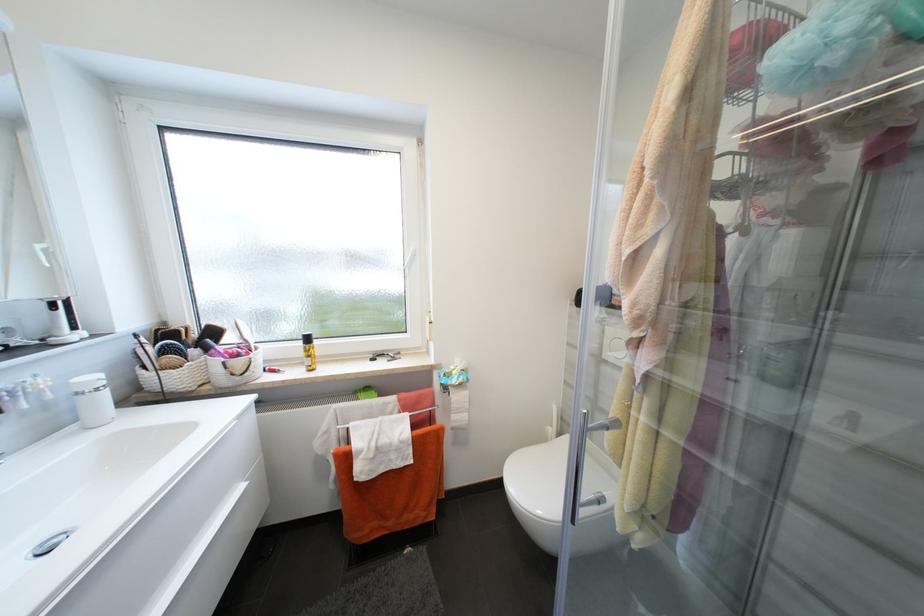
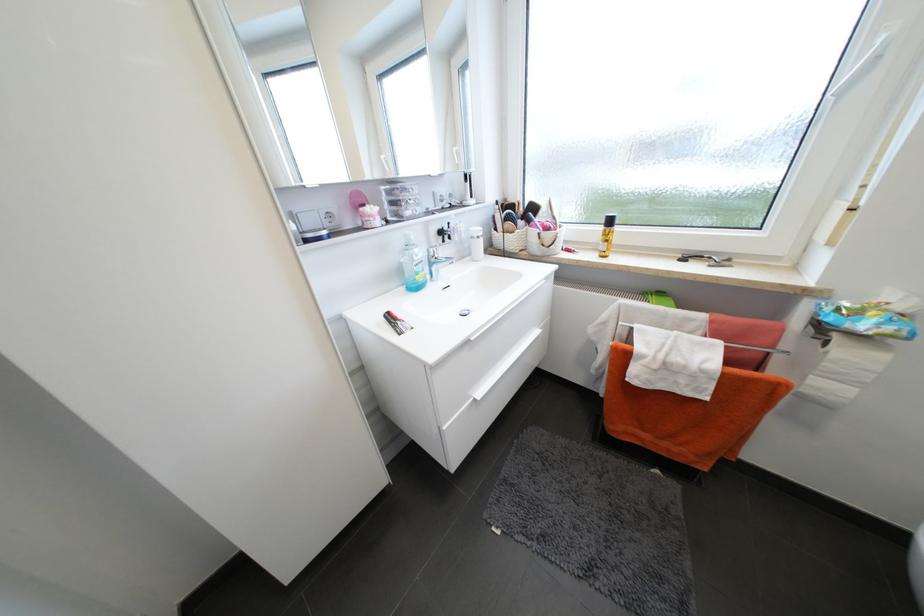
The point at (229, 363) is marked in the first image. Where is the corresponding point in the second image?

(544, 235)